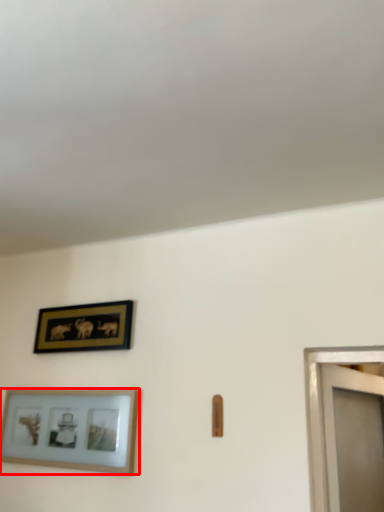
Question: Observing the image, what is the correct spatial positioning of picture frame (annotated by the red box) in reference to picture frame?

Choices:
 (A) right
 (B) left

Answer: (B)